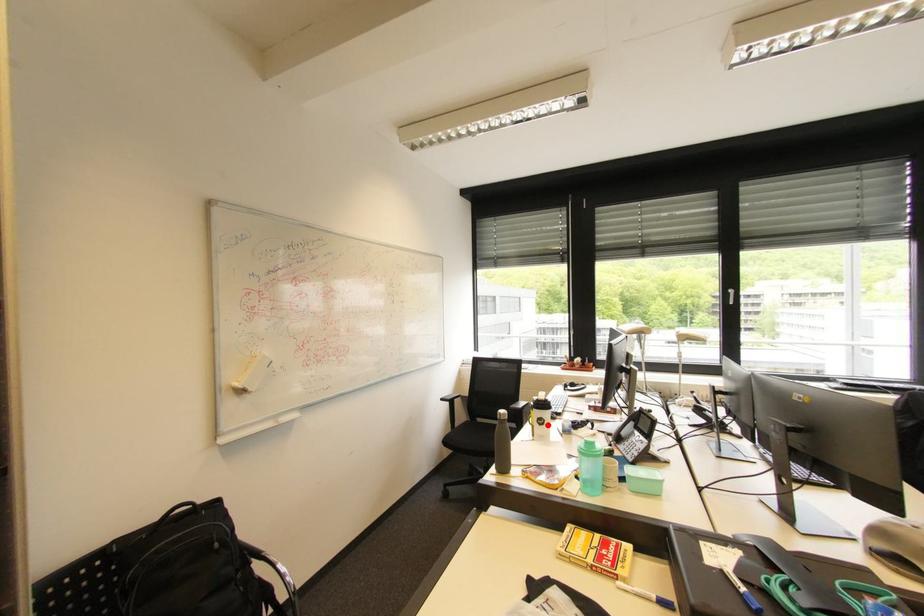
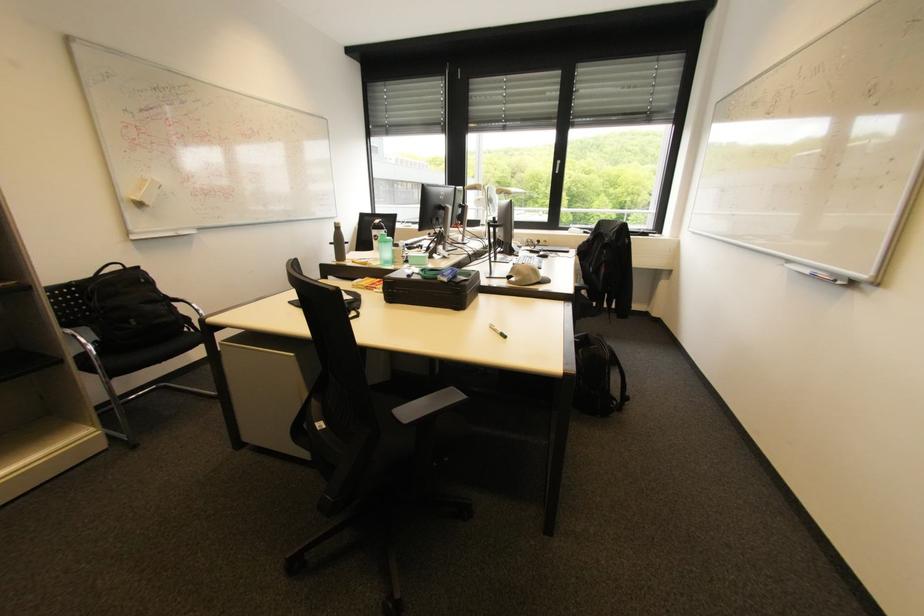
Question: I am providing you with two images of the same scene from different viewpoints. Given a red point in image1, look at the same physical point in image2. Is it:

Choices:
 (A) Closer to the viewpoint
 (B) Farther from the viewpoint

Answer: (A)